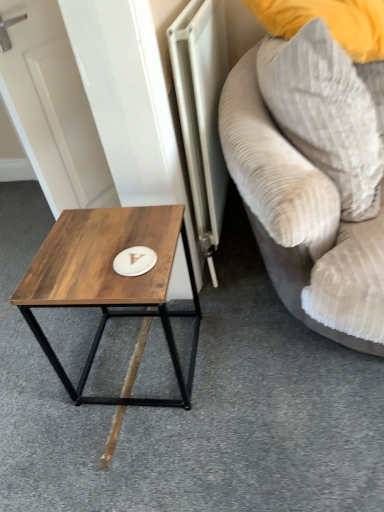
Locate an element on the screen. blank space situated above wooden table at left (from a real-world perspective) is located at coordinates click(101, 246).